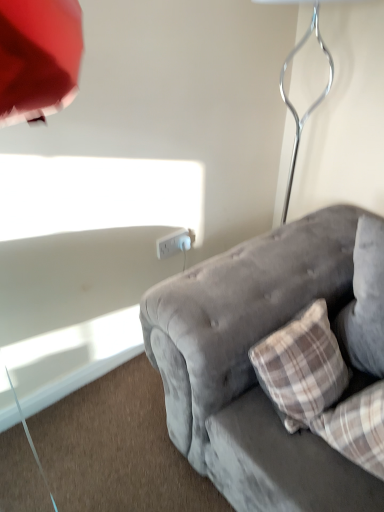
Question: Is white plastic power outlet at center outside metallic silver table lamp at upper right?

Choices:
 (A) no
 (B) yes

Answer: (B)

Question: Is white plastic power outlet at center surrounding metallic silver table lamp at upper right?

Choices:
 (A) yes
 (B) no

Answer: (B)

Question: Considering the relative positions of white plastic power outlet at center and metallic silver table lamp at upper right in the image provided, is white plastic power outlet at center to the left of metallic silver table lamp at upper right from the viewer's perspective?

Choices:
 (A) no
 (B) yes

Answer: (B)

Question: Is white plastic power outlet at center aimed at metallic silver table lamp at upper right?

Choices:
 (A) no
 (B) yes

Answer: (A)

Question: From the image's perspective, is white plastic power outlet at center over metallic silver table lamp at upper right?

Choices:
 (A) no
 (B) yes

Answer: (A)

Question: Based on their positions, is metallic silver table lamp at upper right located to the left or right of velvet gray couch at lower right?

Choices:
 (A) left
 (B) right

Answer: (A)

Question: Considering the positions of metallic silver table lamp at upper right and velvet gray couch at lower right in the image, is metallic silver table lamp at upper right bigger or smaller than velvet gray couch at lower right?

Choices:
 (A) big
 (B) small

Answer: (B)

Question: From a real-world perspective, is metallic silver table lamp at upper right physically located above or below velvet gray couch at lower right?

Choices:
 (A) above
 (B) below

Answer: (A)

Question: Considering the positions of metallic silver table lamp at upper right and velvet gray couch at lower right in the image, is metallic silver table lamp at upper right taller or shorter than velvet gray couch at lower right?

Choices:
 (A) short
 (B) tall

Answer: (B)

Question: Is metallic silver table lamp at upper right taller or shorter than white plastic power outlet at center?

Choices:
 (A) short
 (B) tall

Answer: (B)

Question: Is metallic silver table lamp at upper right inside or outside of white plastic power outlet at center?

Choices:
 (A) inside
 (B) outside

Answer: (B)

Question: Is point (369, 140) positioned closer to the camera than point (183, 229)?

Choices:
 (A) farther
 (B) closer

Answer: (B)

Question: In terms of size, does metallic silver table lamp at upper right appear bigger or smaller than white plastic power outlet at center?

Choices:
 (A) big
 (B) small

Answer: (A)

Question: In terms of size, does white plastic power outlet at center appear bigger or smaller than velvet gray couch at lower right?

Choices:
 (A) small
 (B) big

Answer: (A)

Question: From the image's perspective, is white plastic power outlet at center above or below velvet gray couch at lower right?

Choices:
 (A) above
 (B) below

Answer: (A)